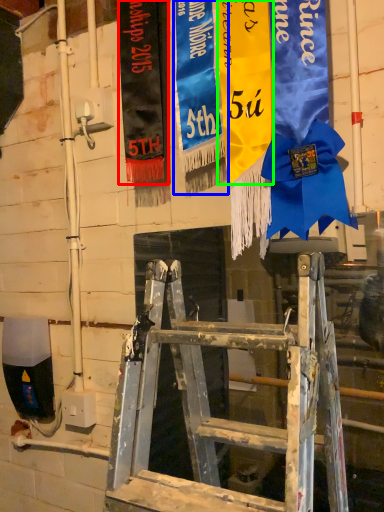
Question: Based on their relative distances, which object is nearer to tapestry (highlighted by a red box)? Choose from tapestry (highlighted by a blue box) and tapestry (highlighted by a green box).

Choices:
 (A) tapestry
 (B) tapestry

Answer: (A)